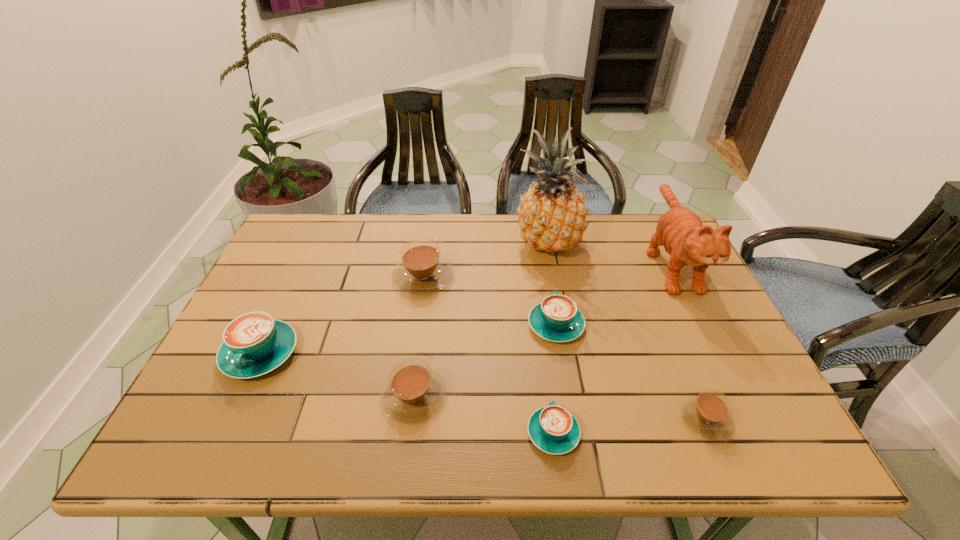
Find the location of a particular element. The width and height of the screenshot is (960, 540). free area in between the second tallest object and the rightmost cappuccino is located at coordinates (x=687, y=340).

Locate an element on the screen. blank region between the cat and the pineapple is located at coordinates (609, 253).

The width and height of the screenshot is (960, 540). Identify the location of unoccupied position between the yellow pineapple and the leftmost cappuccino. (403, 298).

I want to click on vacant space that's between the leftmost cappuccino and the second biggest brown cappuccino, so click(x=337, y=375).

I want to click on empty location between the pineapple and the second smallest turquoise cappuccino, so click(551, 284).

You are a GUI agent. You are given a task and a screenshot of the screen. Output one action in this format:
    pyautogui.click(x=<x>, y=<y>)
    Task: Click on the object that ranks as the third closest to the nearest turquoise cappuccino
    
    Given the screenshot: What is the action you would take?
    tap(708, 414)

Identify which object is the third closest to the second biggest brown cappuccino. Please provide its 2D coordinates. Your answer should be formatted as a tuple, i.e. [(x, y)], where the tuple contains the x and y coordinates of a point satisfying the conditions above.

[(254, 343)]

Select which cappuccino is the third closest to the second biggest turquoise cappuccino. Please provide its 2D coordinates. Your answer should be formatted as a tuple, i.e. [(x, y)], where the tuple contains the x and y coordinates of a point satisfying the conditions above.

[(413, 393)]

Locate an element on the screen. The height and width of the screenshot is (540, 960). cappuccino that can be found as the fifth closest to the farthest cappuccino is located at coordinates (708, 414).

At what (x,y) coordinates should I click in order to perform the action: click on brown cappuccino that is the second closest to the farthest brown cappuccino. Please return your answer as a coordinate pair (x, y). Looking at the image, I should click on (708, 414).